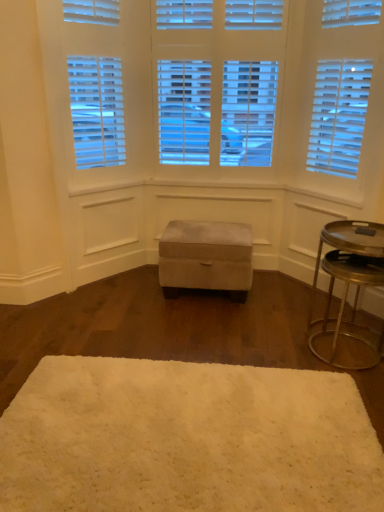
Question: Looking at their shapes, would you say white fluffy rug at center is wider or thinner than metallic gold tray at right?

Choices:
 (A) thin
 (B) wide

Answer: (B)

Question: From the image's perspective, relative to metallic gold tray at right, is white fluffy rug at center above or below?

Choices:
 (A) below
 (B) above

Answer: (A)

Question: Considering the real-world distances, which object is farthest from the suede ottoman at center?

Choices:
 (A) metallic gold tray at right
 (B) white fluffy rug at center

Answer: (B)

Question: Which object is the closest to the metallic gold tray at right?

Choices:
 (A) white fluffy rug at center
 (B) suede ottoman at center

Answer: (B)